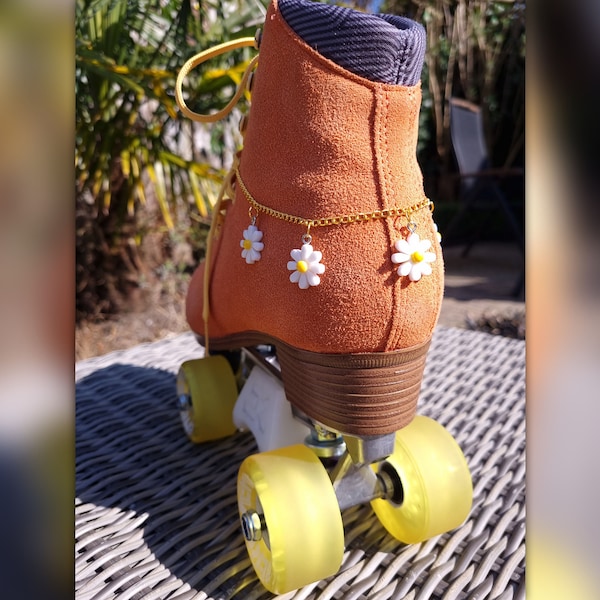
Where is `chair`? This screenshot has width=600, height=600. chair is located at coordinates point(472,139).